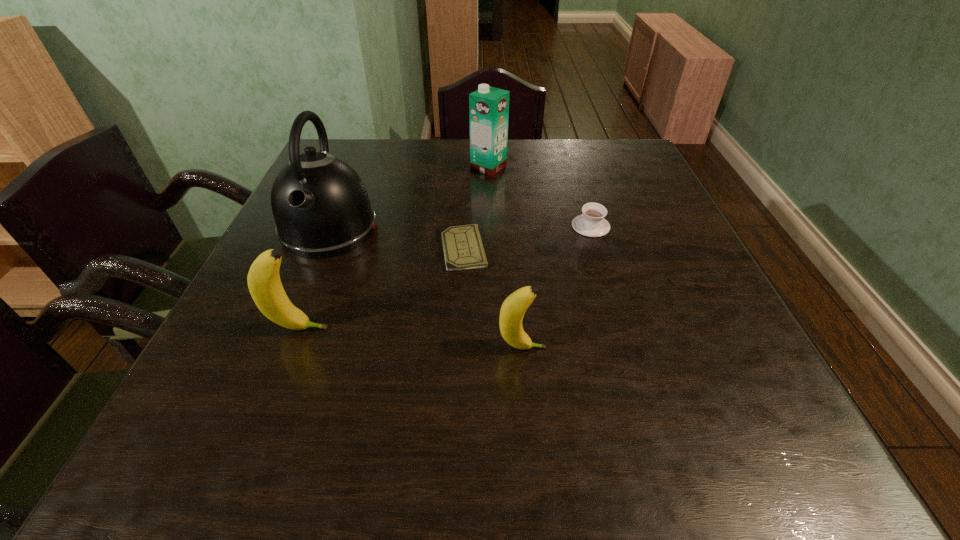
All bananas are currently evenly spaced. To continue this pattern, where would you add another banana on the right? Please point out a vacant spot. Please provide its 2D coordinates. Your answer should be formatted as a tuple, i.e. [(x, y)], where the tuple contains the x and y coordinates of a point satisfying the conditions above.

[(764, 369)]